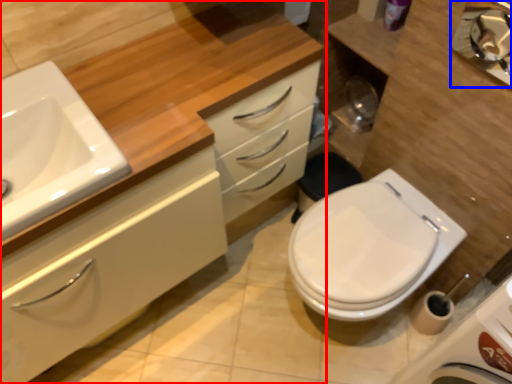
Question: Among these objects, which one is nearest to the camera, bathroom cabinet (highlighted by a red box) or mirror (highlighted by a blue box)?

Choices:
 (A) bathroom cabinet
 (B) mirror

Answer: (A)